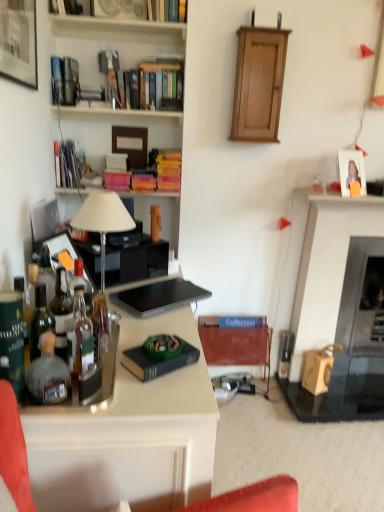
Locate an element on the screen. free point above blue hardcover book at center, which appears as the second book when ordered from the bottom (from a real-world perspective) is located at coordinates (157, 352).